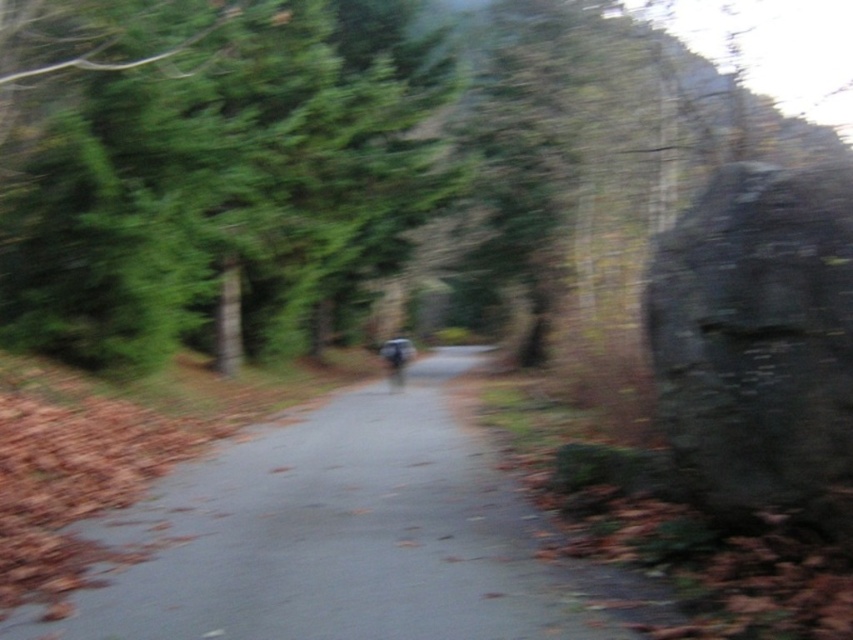
You are a photographer riding a metallic silver motorcycle at center on a forest road. You want to take a photo of the dark gray stone boulder at right. Since the motorcycle is moving, will the boulder be visible in your rearview mirror?

The dark gray stone boulder at right is in front of the metallic silver motorcycle at center, so it will not be visible in the rearview mirror as it is ahead of the motorcycle, not behind.

You are a photographer planning to capture a wide shot of the metallic silver motorcycle at center and the dark gray stone boulder at right. Given their sizes, which object will appear smaller in the photo?

The dark gray stone boulder at right will appear smaller in the photo because its width is less than that of the metallic silver motorcycle at center.

You are driving along the road and need to navigate around the green leafy tree at upper left and the smooth asphalt trail at center. Which object is higher in elevation compared to the other?

The green leafy tree at upper left is located above the smooth asphalt trail at center, so it has a higher elevation.